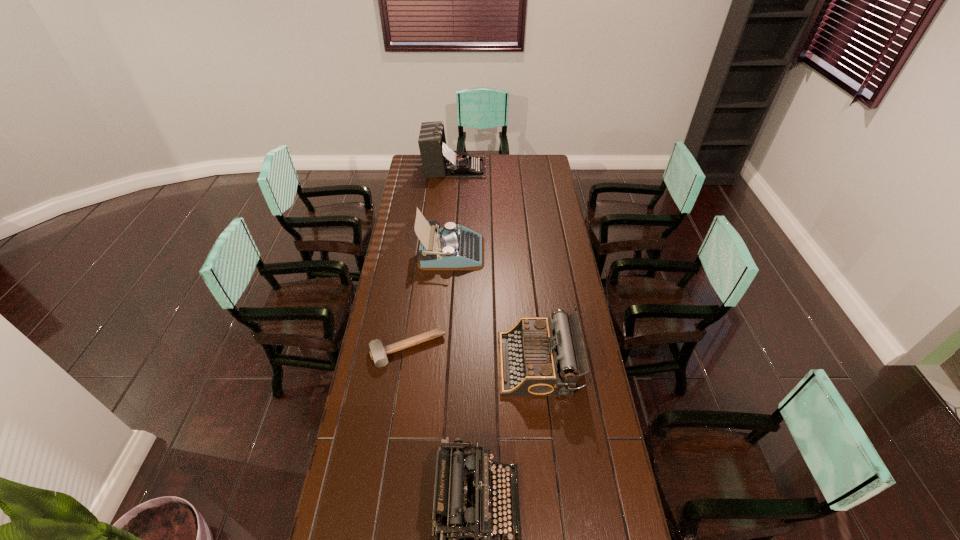
Identify the location of free space between the fourth nearest object and the tallest typewriter. Image resolution: width=960 pixels, height=540 pixels. (453, 210).

At what (x,y) coordinates should I click in order to perform the action: click on free space between the second farthest typewriter and the farthest object. Please return your answer as a coordinate pair (x, y). Image resolution: width=960 pixels, height=540 pixels. Looking at the image, I should click on (453, 210).

This screenshot has width=960, height=540. I want to click on blank region between the second nearest typewriter and the second farthest typewriter, so click(x=495, y=308).

Locate which object ranks fourth in proximity to the second nearest typewriter. Please provide its 2D coordinates. Your answer should be formatted as a tuple, i.e. [(x, y)], where the tuple contains the x and y coordinates of a point satisfying the conditions above.

[(438, 160)]

This screenshot has height=540, width=960. In order to click on the second closest object to the third farthest typewriter in this screenshot , I will do `click(378, 353)`.

Image resolution: width=960 pixels, height=540 pixels. In order to click on typewriter that can be found as the third closest to the shortest object in this screenshot , I will do `click(453, 248)`.

Locate an element on the screen. typewriter that can be found as the closest to the second farthest object is located at coordinates (537, 357).

Find the location of a particular element. Image resolution: width=960 pixels, height=540 pixels. vacant space that satisfies the following two spatial constraints: 1. inside the open case of the farthest typewriter; 2. on the front side of the mallet is located at coordinates (441, 349).

Locate an element on the screen. vacant area in the image that satisfies the following two spatial constraints: 1. on the typing side of the third nearest typewriter; 2. on the front side of the mallet is located at coordinates (445, 349).